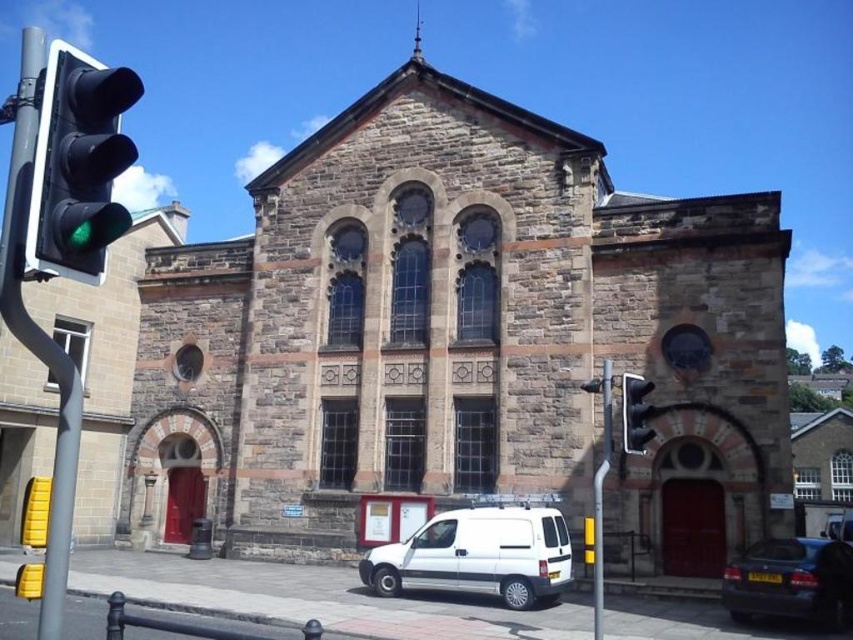
Question: Does brown stone church at center have a greater width compared to green glass traffic light at left?

Choices:
 (A) yes
 (B) no

Answer: (A)

Question: Which object appears farthest from the camera in this image?

Choices:
 (A) metallic traffic light at right
 (B) shiny black car at lower right
 (C) white matte van at center
 (D) brown stone church at center

Answer: (D)

Question: Can you confirm if brown stone church at center is wider than metallic traffic light at right?

Choices:
 (A) no
 (B) yes

Answer: (B)

Question: Which object is positioned farthest from the white matte van at center?

Choices:
 (A) metallic traffic light at right
 (B) brown stone church at center

Answer: (B)

Question: Estimate the real-world distances between objects in this image. Which object is farther from the shiny black car at lower right?

Choices:
 (A) brown stone church at center
 (B) metallic traffic light at right
 (C) green glass traffic light at left

Answer: (C)

Question: Does white matte van at center appear under shiny black car at lower right?

Choices:
 (A) yes
 (B) no

Answer: (B)